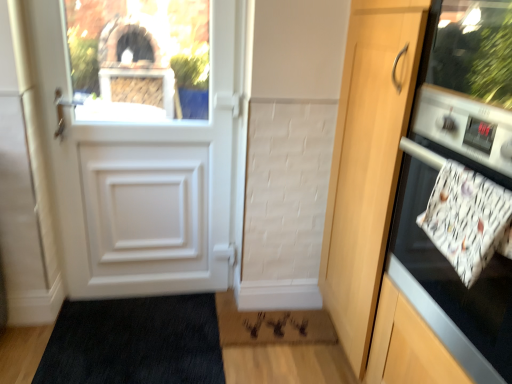
Question: From the image's perspective, is rug with textured pile at lower center under wooden door at right?

Choices:
 (A) no
 (B) yes

Answer: (B)

Question: Is rug with textured pile at lower center oriented towards wooden door at right?

Choices:
 (A) yes
 (B) no

Answer: (B)

Question: Is the depth of rug with textured pile at lower center greater than that of wooden door at right?

Choices:
 (A) yes
 (B) no

Answer: (A)

Question: Is rug with textured pile at lower center facing away from wooden door at right?

Choices:
 (A) no
 (B) yes

Answer: (A)

Question: From the image's perspective, is rug with textured pile at lower center over wooden door at right?

Choices:
 (A) no
 (B) yes

Answer: (A)

Question: From their relative heights in the image, would you say matte glass window screen at upper left is taller or shorter than white glossy oven at right?

Choices:
 (A) short
 (B) tall

Answer: (A)

Question: Considering the positions of point (138, 26) and point (492, 350), is point (138, 26) closer or farther from the camera than point (492, 350)?

Choices:
 (A) closer
 (B) farther

Answer: (B)

Question: Is matte glass window screen at upper left wider or thinner than white glossy oven at right?

Choices:
 (A) wide
 (B) thin

Answer: (B)

Question: Considering the positions of matte glass window screen at upper left and white glossy oven at right in the image, is matte glass window screen at upper left bigger or smaller than white glossy oven at right?

Choices:
 (A) small
 (B) big

Answer: (A)

Question: Looking at the image, does wooden door at right seem bigger or smaller compared to matte glass window screen at upper left?

Choices:
 (A) small
 (B) big

Answer: (B)

Question: From a real-world perspective, is wooden door at right positioned above or below matte glass window screen at upper left?

Choices:
 (A) above
 (B) below

Answer: (B)

Question: In the image, is wooden door at right on the left side or the right side of matte glass window screen at upper left?

Choices:
 (A) left
 (B) right

Answer: (B)

Question: Considering the positions of wooden door at right and matte glass window screen at upper left in the image, is wooden door at right wider or thinner than matte glass window screen at upper left?

Choices:
 (A) wide
 (B) thin

Answer: (A)

Question: Considering the relative positions of white glossy oven at right and rug with textured pile at lower center in the image provided, is white glossy oven at right to the left or to the right of rug with textured pile at lower center?

Choices:
 (A) right
 (B) left

Answer: (A)

Question: Based on their sizes in the image, would you say white glossy oven at right is bigger or smaller than rug with textured pile at lower center?

Choices:
 (A) small
 (B) big

Answer: (B)